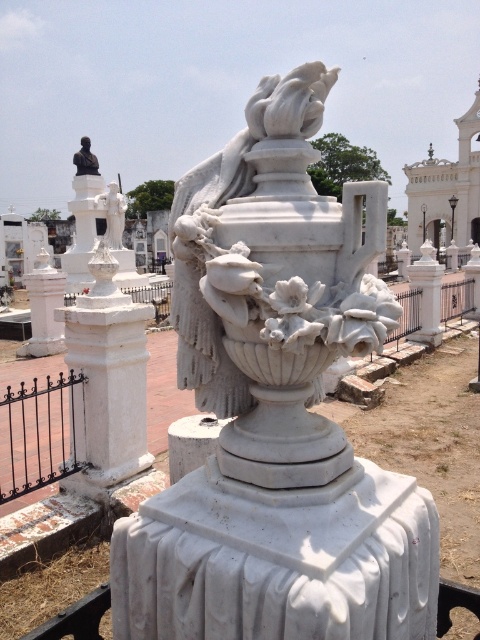
You are an architect designing a new cemetery layout and need to place a new rectangular bench between the white marble post at left and the matte white statue at upper left. Given that the bench requires a minimum of 1.2 meters in width to accommodate visitors comfortably, can you determine if there is enough space between the two objects based on their widths?

The white marble post at left has a lesser width compared to the matte white statue at upper left, but the exact widths are not provided. Therefore, it is impossible to determine if the space between them is sufficient for the bench without additional measurements.

You are an architect assessing the layout of this cemetery. You need to determine which object is taller between the white marble urn at center and the matte white statue at upper left. Based on the scene, which one is taller?

The matte white statue at upper left is taller than the white marble urn at center.

You are a visitor standing at the entrance of the cemetery facing the monument. You notice two points marked on the ground. The first point is at coordinate point(137,336) and the second is at point(104,200). Which point is closer to you?

Point(137,336) is in front of point(104,200), so the first point is closer to you.